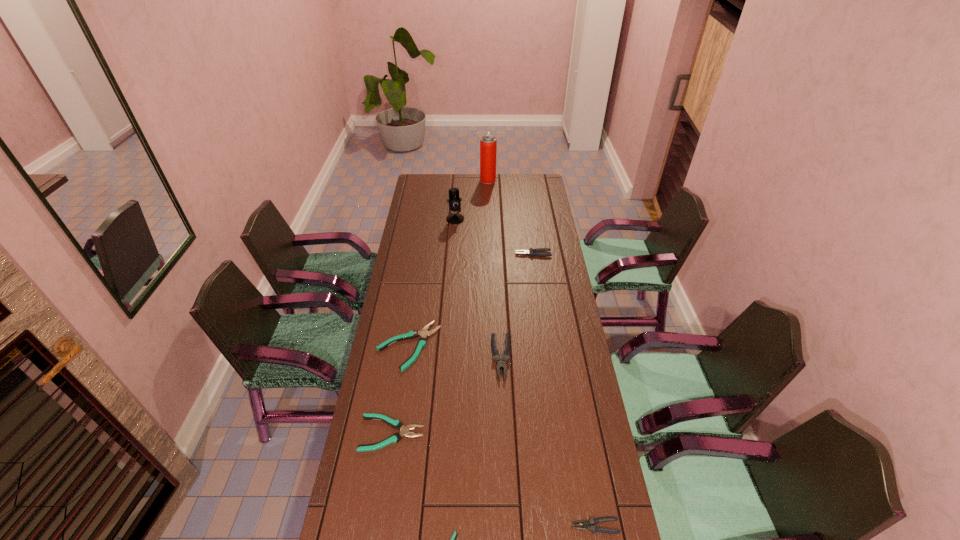
This screenshot has width=960, height=540. Identify the location of aerosol can. (488, 143).

Image resolution: width=960 pixels, height=540 pixels. Find the location of `the farthest object`. the farthest object is located at coordinates (488, 143).

At what (x,y) coordinates should I click in order to perform the action: click on microphone. Please return your answer as a coordinate pair (x, y). This screenshot has height=540, width=960. Looking at the image, I should click on (454, 200).

In order to click on the seventh nearest object in this screenshot , I will do `click(454, 200)`.

Find the location of `the sixth shortest object`. the sixth shortest object is located at coordinates (500, 363).

Locate an element on the screen. This screenshot has width=960, height=540. the leftmost gray pliers is located at coordinates (500, 363).

Identify the location of the fifth shortest object. The width and height of the screenshot is (960, 540). (532, 252).

This screenshot has height=540, width=960. Find the location of `the fifth shortest pliers`. the fifth shortest pliers is located at coordinates [532, 252].

This screenshot has height=540, width=960. Find the location of `the farthest teal pliers`. the farthest teal pliers is located at coordinates (422, 342).

At what (x,y) coordinates should I click in order to perform the action: click on the nearest gray pliers. Please return your answer as a coordinate pair (x, y). This screenshot has width=960, height=540. Looking at the image, I should click on (592, 521).